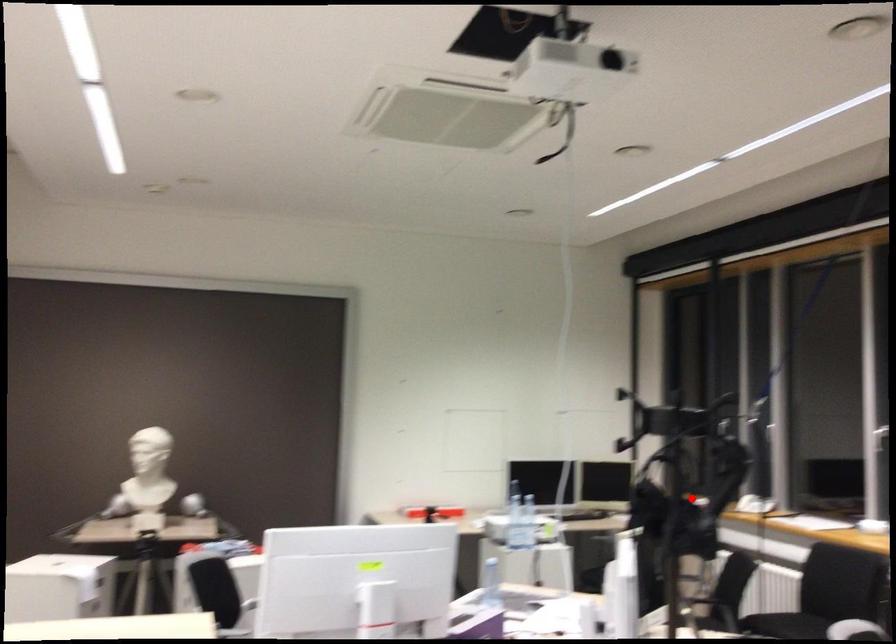
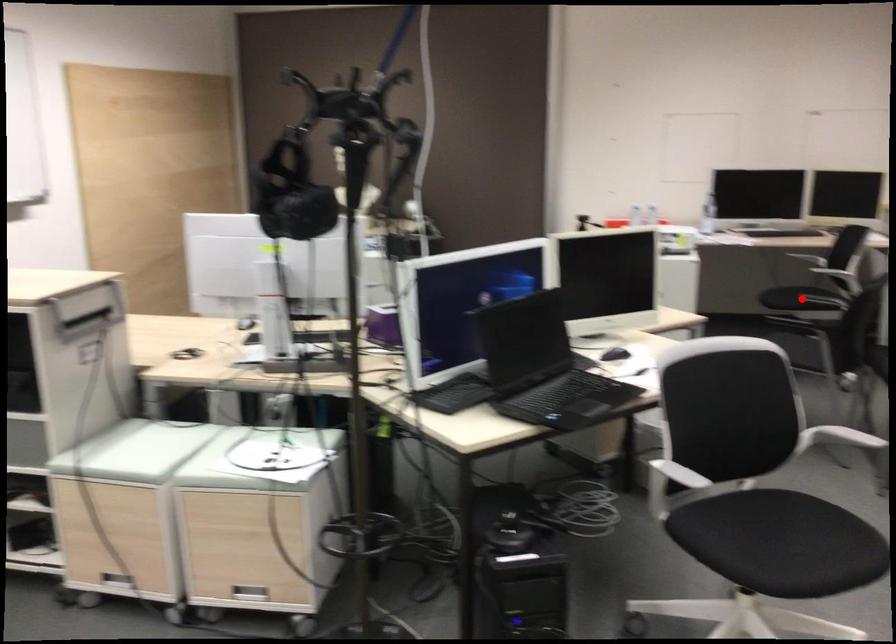
I am providing you with two images of the same scene from different viewpoints. A red point is marked on the first image and another point is marked on the second image. Does the point marked in image1 correspond to the same location as the one in image2?

No